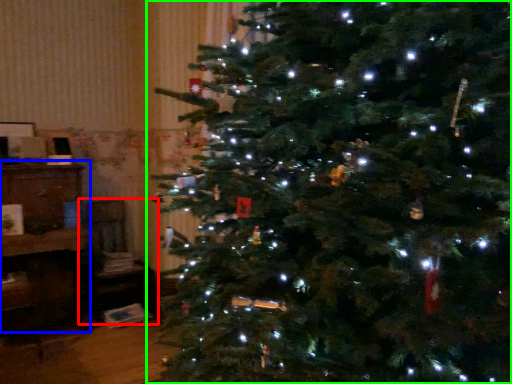
Question: Based on their relative distances, which object is farther from chair (highlighted by a red box)? Choose from furniture (highlighted by a blue box) and christmas tree (highlighted by a green box).

Choices:
 (A) furniture
 (B) christmas tree

Answer: (B)